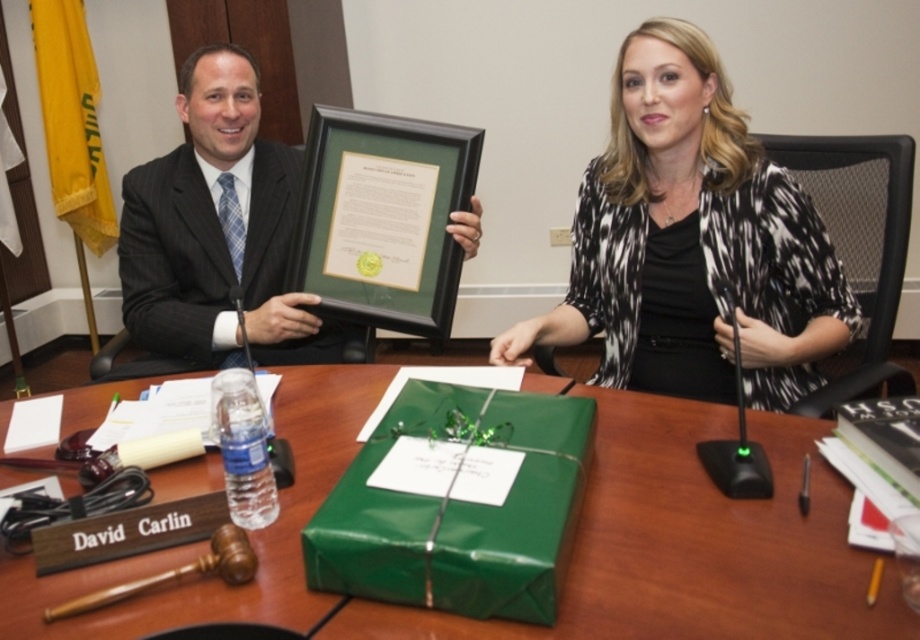
Between green paper wrapped gift at center and matte black suit at center, which one appears on the right side from the viewer's perspective?

From the viewer's perspective, green paper wrapped gift at center appears more on the right side.

Where is `green paper wrapped gift at center`? This screenshot has height=640, width=920. green paper wrapped gift at center is located at coordinates (690, 541).

Can you confirm if black and white printed blouse at center is bigger than matte black suit at center?

Yes, black and white printed blouse at center is bigger than matte black suit at center.

Who is more forward, [776,294] or [236,156]?

Positioned in front is point [776,294].

The width and height of the screenshot is (920, 640). In order to click on black and white printed blouse at center in this screenshot , I will do `click(692, 243)`.

Who is shorter, black and white printed blouse at center or dark gray pinstripe suit at left?

With less height is dark gray pinstripe suit at left.

Based on the photo, which is above, black and white printed blouse at center or dark gray pinstripe suit at left?

dark gray pinstripe suit at left is above.

I want to click on black and white printed blouse at center, so click(x=692, y=243).

Where is `black and white printed blouse at center`? The width and height of the screenshot is (920, 640). black and white printed blouse at center is located at coordinates (692, 243).